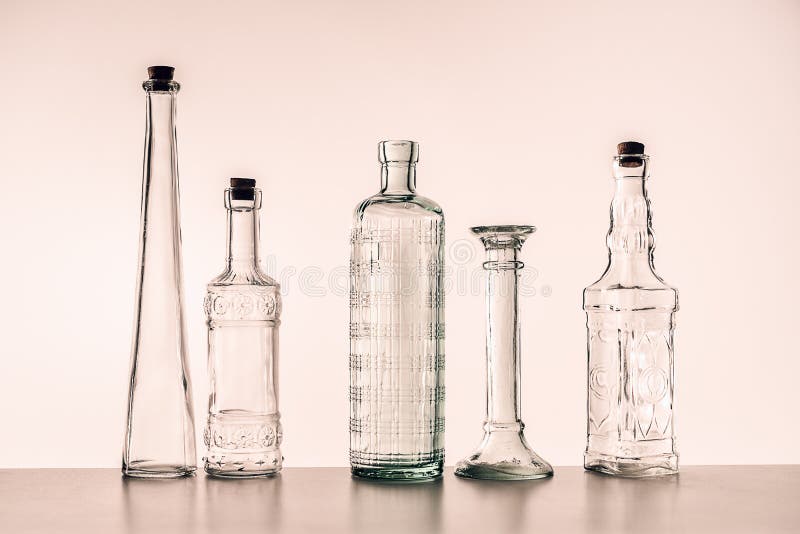
At what (x,y) coordinates should I click in order to perform the action: click on bottle with green tint. Please return your answer as a coordinate pair (x, y). This screenshot has height=534, width=800. Looking at the image, I should click on (404, 380).